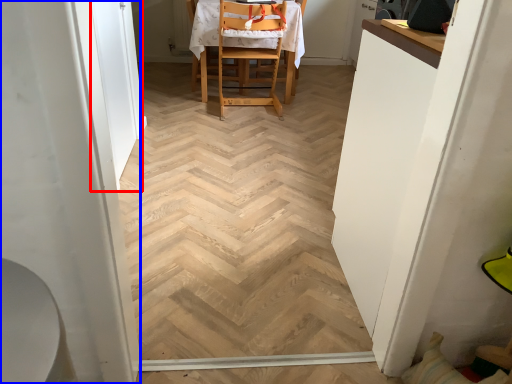
Question: Among these objects, which one is nearest to the camera, screen door (highlighted by a red box) or screen door (highlighted by a blue box)?

Choices:
 (A) screen door
 (B) screen door

Answer: (B)